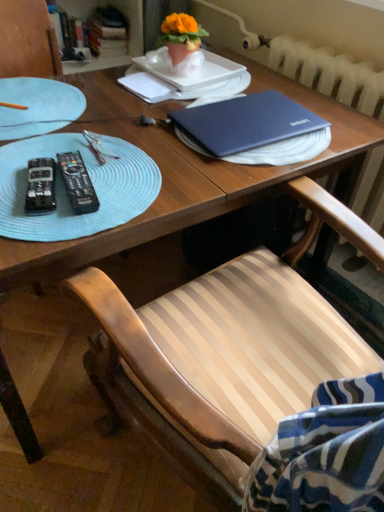
Where is `free area behind black plastic remote control at left, the 2th remote control when ordered from right to left`? free area behind black plastic remote control at left, the 2th remote control when ordered from right to left is located at coordinates (67, 143).